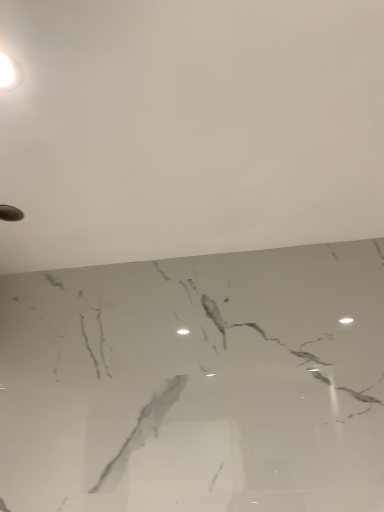
Question: Looking at their shapes, would you say white glossy light fixture at upper left is wider or thinner than white marble floor at lower center?

Choices:
 (A) wide
 (B) thin

Answer: (B)

Question: In the image, is white glossy light fixture at upper left positioned in front of or behind white marble floor at lower center?

Choices:
 (A) behind
 (B) front

Answer: (A)

Question: Considering the positions of point [8, 55] and point [223, 60], is point [8, 55] closer or farther from the camera than point [223, 60]?

Choices:
 (A) closer
 (B) farther

Answer: (A)

Question: From the image's perspective, relative to white glossy light fixture at upper left, is white marble floor at lower center above or below?

Choices:
 (A) above
 (B) below

Answer: (B)

Question: Is white marble floor at lower center inside the boundaries of white glossy light fixture at upper left, or outside?

Choices:
 (A) outside
 (B) inside

Answer: (A)

Question: Considering their positions, is white marble floor at lower center located in front of or behind white glossy light fixture at upper left?

Choices:
 (A) behind
 (B) front

Answer: (B)

Question: In terms of width, does white marble floor at lower center look wider or thinner when compared to white glossy light fixture at upper left?

Choices:
 (A) thin
 (B) wide

Answer: (B)